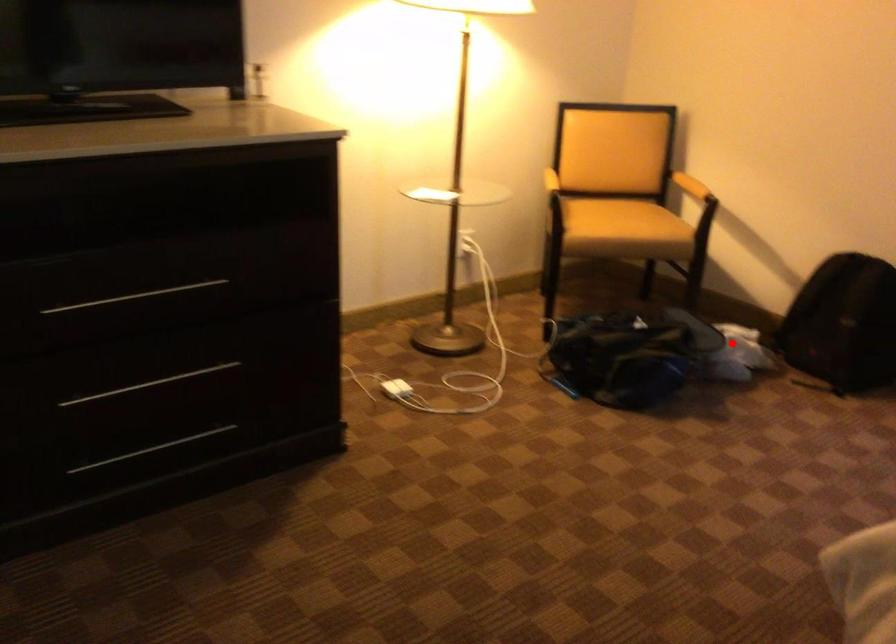
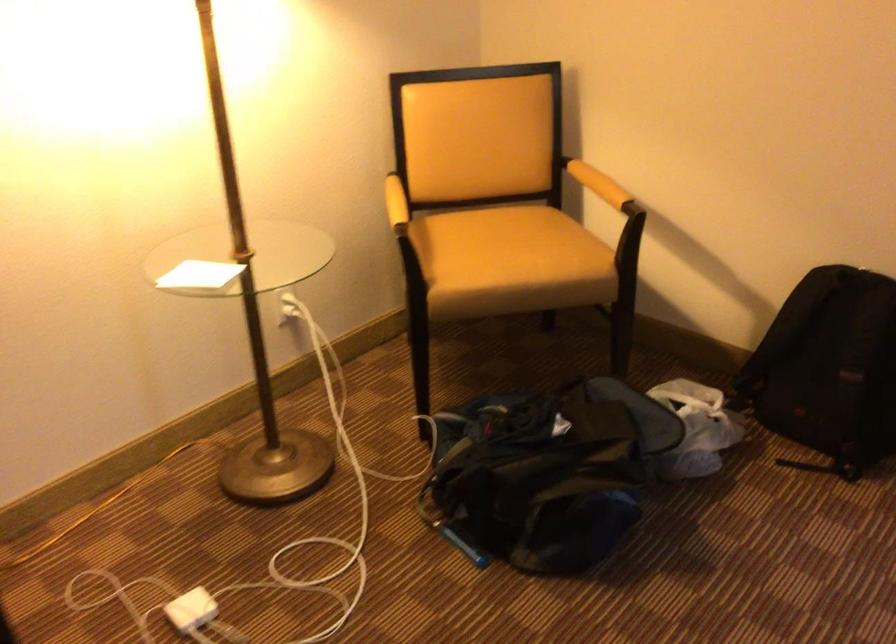
In the second image, find the point that corresponds to the highlighted location in the first image.

(696, 428)